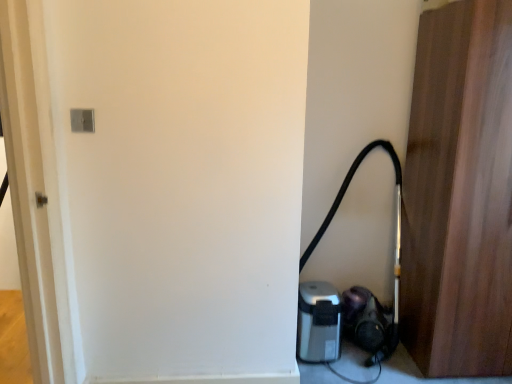
Where is `black rubber garden hose at lower right`? black rubber garden hose at lower right is located at coordinates (366, 288).

This screenshot has height=384, width=512. What are the coordinates of `silver metallic coffee maker at lower right` in the screenshot? It's located at (318, 322).

From the image's perspective, does black rubber garden hose at lower right appear higher than silver metallic coffee maker at lower right?

Yes, from the image's perspective, black rubber garden hose at lower right is on top of silver metallic coffee maker at lower right.

Between black rubber garden hose at lower right and silver metallic coffee maker at lower right, which one appears on the right side from the viewer's perspective?

black rubber garden hose at lower right.

Where is `appliance on the left of black rubber garden hose at lower right`? The height and width of the screenshot is (384, 512). appliance on the left of black rubber garden hose at lower right is located at coordinates (318, 322).

Is black rubber garden hose at lower right smaller than silver metallic coffee maker at lower right?

No.

From the picture: Based on their positions, is silver metallic coffee maker at lower right located to the left or right of wooden door at right?

Clearly, silver metallic coffee maker at lower right is on the left of wooden door at right in the image.

Are silver metallic coffee maker at lower right and wooden door at right far apart?

silver metallic coffee maker at lower right is actually quite close to wooden door at right.

Between point (304, 346) and point (423, 222), which one is positioned behind?

The point (304, 346) is behind.

How many degrees apart are the facing directions of silver metallic coffee maker at lower right and wooden door at right?

0.00121 degrees separate the facing orientations of silver metallic coffee maker at lower right and wooden door at right.

Locate an element on the screen. The width and height of the screenshot is (512, 384). door that appears on the right of black rubber garden hose at lower right is located at coordinates (460, 193).

Can you confirm if black rubber garden hose at lower right is taller than wooden door at right?

In fact, black rubber garden hose at lower right may be shorter than wooden door at right.

Can you confirm if black rubber garden hose at lower right is bigger than wooden door at right?

No.

Which is behind, black rubber garden hose at lower right or wooden door at right?

black rubber garden hose at lower right is further away from the camera.

How many degrees apart are the facing directions of wooden door at right and black rubber garden hose at lower right?

They differ by 0.000909 degrees in their facing directions.

Find the location of a particular element. The image size is (512, 384). garden hose that is below the wooden door at right (from the image's perspective) is located at coordinates (366, 288).

Is wooden door at right next to black rubber garden hose at lower right and touching it?

No, wooden door at right is not beside black rubber garden hose at lower right.

Could you tell me if wooden door at right is turned towards black rubber garden hose at lower right?

No, wooden door at right is not turned towards black rubber garden hose at lower right.

From a real-world perspective, is wooden door at right under silver metallic coffee maker at lower right?

No, from a real-world perspective, wooden door at right is not below silver metallic coffee maker at lower right.

This screenshot has height=384, width=512. I want to click on door positioned vertically above the silver metallic coffee maker at lower right (from a real-world perspective), so click(x=460, y=193).

Looking at this image, which object is positioned more to the right, wooden door at right or silver metallic coffee maker at lower right?

Positioned to the right is wooden door at right.

Is wooden door at right positioned far away from silver metallic coffee maker at lower right?

No, wooden door at right is not far from silver metallic coffee maker at lower right.

Does silver metallic coffee maker at lower right have a lesser width compared to black rubber garden hose at lower right?

Indeed, silver metallic coffee maker at lower right has a lesser width compared to black rubber garden hose at lower right.

Can you confirm if silver metallic coffee maker at lower right is taller than black rubber garden hose at lower right?

No.

Which object is further away from the camera taking this photo, silver metallic coffee maker at lower right or black rubber garden hose at lower right?

silver metallic coffee maker at lower right is further away from the camera.

Based on their sizes in the image, would you say silver metallic coffee maker at lower right is bigger or smaller than black rubber garden hose at lower right?

In the image, silver metallic coffee maker at lower right appears to be smaller than black rubber garden hose at lower right.

Where is `appliance below the black rubber garden hose at lower right (from the image's perspective)`? This screenshot has width=512, height=384. appliance below the black rubber garden hose at lower right (from the image's perspective) is located at coordinates (318, 322).

This screenshot has height=384, width=512. Identify the location of appliance located behind the wooden door at right. (318, 322).

Which object lies nearer to the anchor point black rubber garden hose at lower right, silver metallic coffee maker at lower right or wooden door at right?

silver metallic coffee maker at lower right is positioned closer to the anchor black rubber garden hose at lower right.

In the scene shown: Estimate the real-world distances between objects in this image. Which object is closer to silver metallic coffee maker at lower right, wooden door at right or black rubber garden hose at lower right?

black rubber garden hose at lower right.

Based on their spatial positions, is black rubber garden hose at lower right or silver metallic coffee maker at lower right further from wooden door at right?

silver metallic coffee maker at lower right is further to wooden door at right.

From the picture: Based on their spatial positions, is silver metallic coffee maker at lower right or black rubber garden hose at lower right closer to wooden door at right?

Among the two, black rubber garden hose at lower right is located nearer to wooden door at right.

Looking at the image, which one is located further to silver metallic coffee maker at lower right, black rubber garden hose at lower right or wooden door at right?

wooden door at right is positioned further to the anchor silver metallic coffee maker at lower right.

Based on their spatial positions, is wooden door at right or silver metallic coffee maker at lower right closer to black rubber garden hose at lower right?

Based on the image, silver metallic coffee maker at lower right appears to be nearer to black rubber garden hose at lower right.

At what (x,y) coordinates should I click in order to perform the action: click on garden hose between silver metallic coffee maker at lower right and wooden door at right from left to right. Please return your answer as a coordinate pair (x, y). The width and height of the screenshot is (512, 384). Looking at the image, I should click on (366, 288).